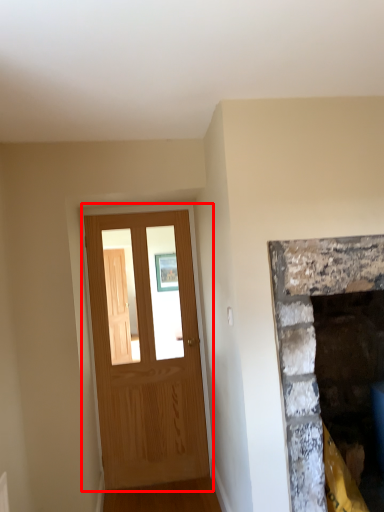
Question: In this image, where is barn door (annotated by the red box) located relative to fireplace?

Choices:
 (A) right
 (B) left

Answer: (B)